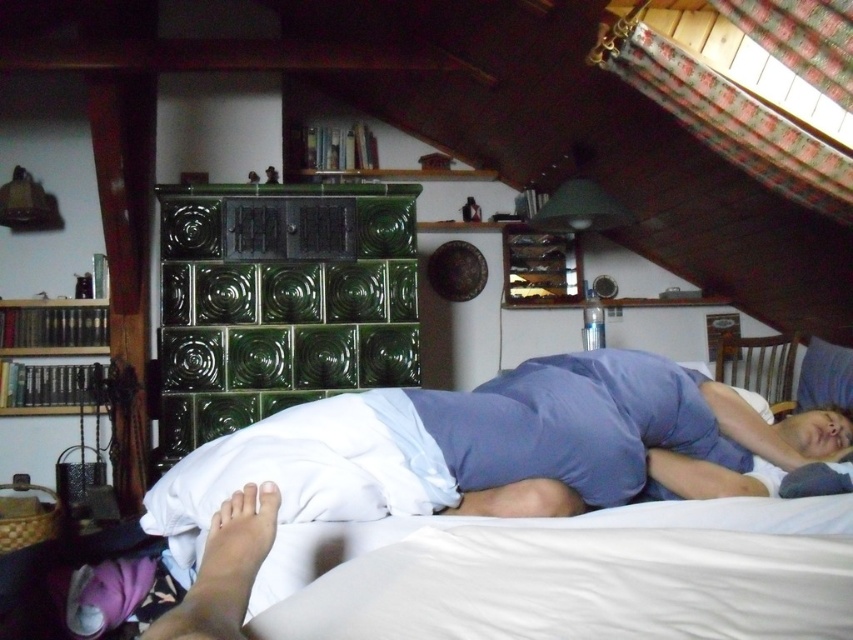
Question: From the image, what is the correct spatial relationship of white soft bed at lower center in relation to dark brown wooden bookshelf at left?

Choices:
 (A) above
 (B) below

Answer: (B)

Question: Which of the following is the closest to the observer?

Choices:
 (A) (451, 492)
 (B) (35, 312)

Answer: (A)

Question: Which object is the farthest from the white soft foot at lower left?

Choices:
 (A) white soft bed at lower center
 (B) dark brown wooden bookshelf at left
 (C) white soft pillow at upper center

Answer: (B)

Question: Estimate the real-world distances between objects in this image. Which object is closer to the dark brown wooden bookshelf at left?

Choices:
 (A) white soft foot at lower left
 (B) white soft bed at lower center
 (C) white soft pillow at upper center

Answer: (B)

Question: In this image, where is white soft bed at lower center located relative to dark brown wooden bookshelf at left?

Choices:
 (A) left
 (B) right

Answer: (B)

Question: Does white soft bed at lower center have a lesser width compared to white soft foot at lower left?

Choices:
 (A) no
 (B) yes

Answer: (A)